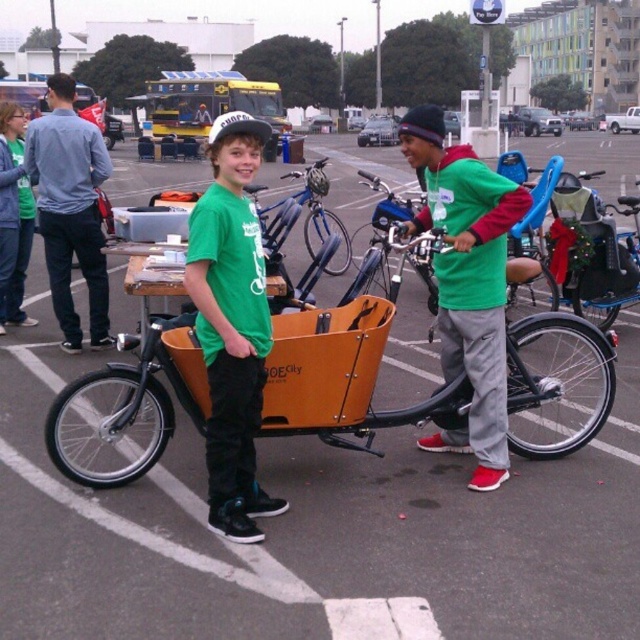
You are a photographer standing in the parking lot scene. You need to capture a photo where both the green matte jacket at center and the blue denim jeans at left are visible. Which object should you focus on to ensure both are in frame without moving the camera?

You should focus on the green matte jacket at center because it has a smaller width than the blue denim jeans at left, so centering on it would still keep the wider jeans in frame.

You are a photographer trying to capture both the green matte shirt at center and the green matte jacket at center in a single frame. Given that your camera has a fixed focus that can only clearly capture objects within a 1.5 meter width, will both items fit within the focus area if their combined width is less than 1.5 meters?

The green matte shirt at center is larger in width than the green matte jacket at center. However, without knowing the exact widths of each item, it is impossible to determine if their combined width is less than 1.5 meters. The photographer cannot be certain if both will fit within the focus area based on the provided information.

Where is the green matte jacket at center located in the image?

The green matte jacket at center is located at the 2D coordinates point (467, 282) in the image.